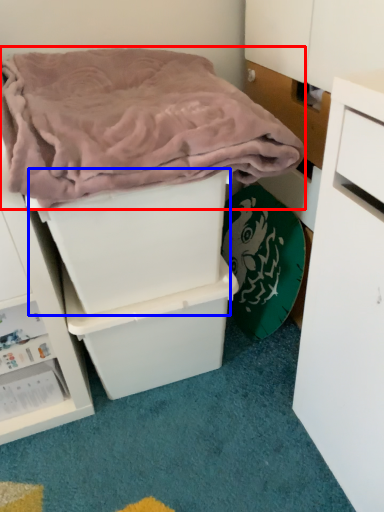
Question: Which object is further to the camera taking this photo, blanket (highlighted by a red box) or storage box (highlighted by a blue box)?

Choices:
 (A) blanket
 (B) storage box

Answer: (B)